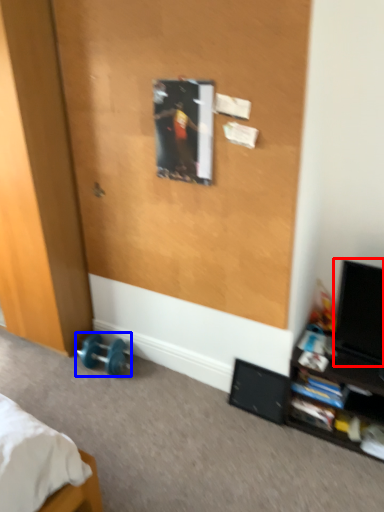
Question: Which point is further to the camera, computer monitor (highlighted by a red box) or dumbbell (highlighted by a blue box)?

Choices:
 (A) computer monitor
 (B) dumbbell

Answer: (B)